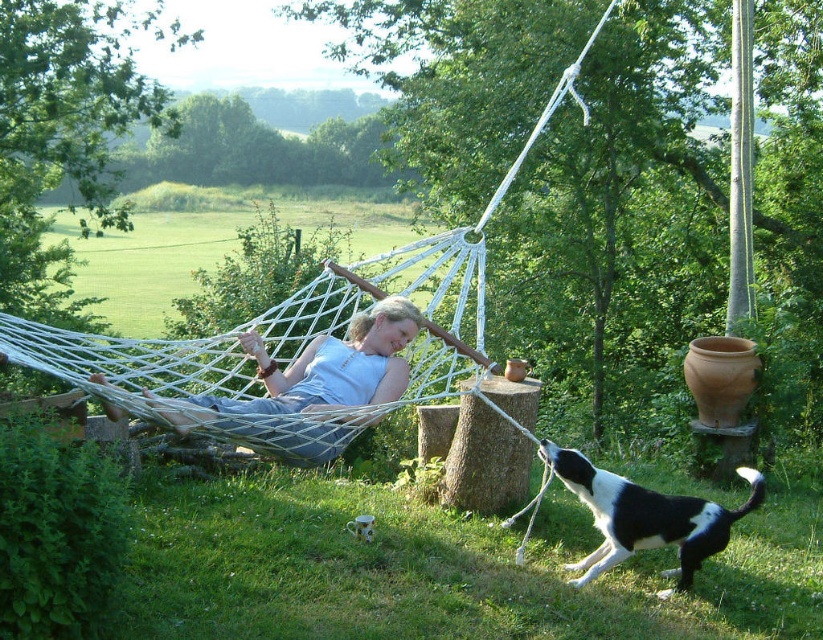
Can you confirm if white rope hammock at center is positioned above black and white fur dog at lower right?

Indeed, white rope hammock at center is positioned over black and white fur dog at lower right.

Is white rope hammock at center taller than black and white fur dog at lower right?

In fact, white rope hammock at center may be shorter than black and white fur dog at lower right.

Is point (147, 339) positioned after point (663, 520)?

That is True.

Find the location of a particular element. The image size is (823, 640). white rope hammock at center is located at coordinates (300, 337).

Can you confirm if white rope hammock at center is wider than white cotton hammock at center?

No.

Between white rope hammock at center and white cotton hammock at center, which one is positioned higher?

white rope hammock at center

Is point (337, 438) behind point (347, 390)?

No.

The height and width of the screenshot is (640, 823). I want to click on white rope hammock at center, so click(x=300, y=337).

Does white cotton hammock at center appear on the left side of black and white fur dog at lower right?

Correct, you'll find white cotton hammock at center to the left of black and white fur dog at lower right.

Is white cotton hammock at center smaller than black and white fur dog at lower right?

No.

Describe the element at coordinates (310, 388) in the screenshot. I see `white cotton hammock at center` at that location.

I want to click on white cotton hammock at center, so click(310, 388).